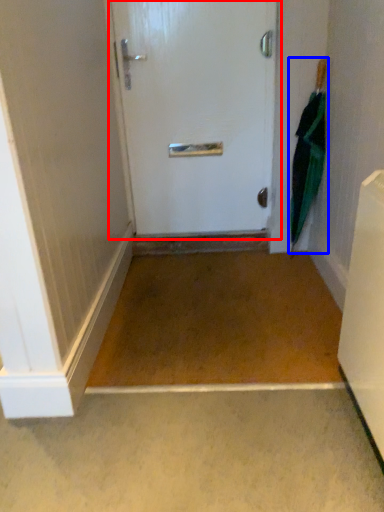
Question: Among these objects, which one is nearest to the camera, door (highlighted by a red box) or umbrella (highlighted by a blue box)?

Choices:
 (A) door
 (B) umbrella

Answer: (B)